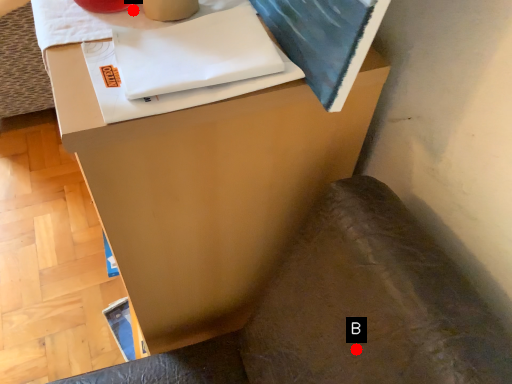
Question: Two points are circled on the image, labeled by A and B beside each circle. Among these points, which one is farthest from the camera?

Choices:
 (A) A is further
 (B) B is further

Answer: (A)